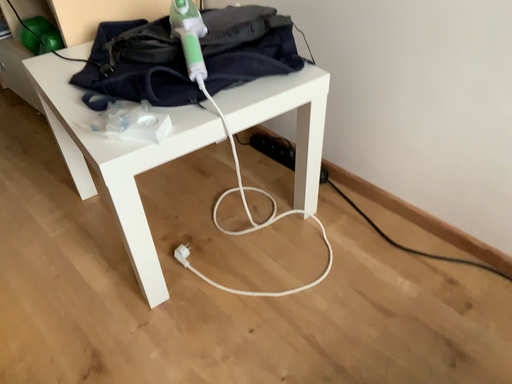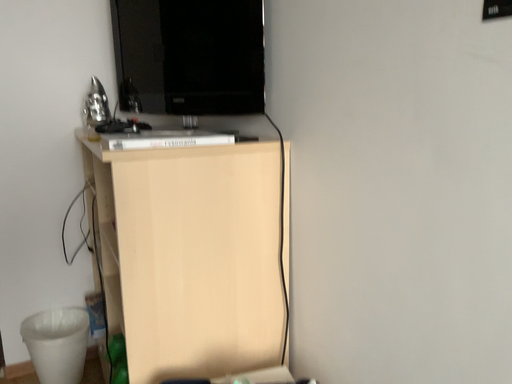
Question: How did the camera likely rotate when shooting the video?

Choices:
 (A) rotated left
 (B) rotated right

Answer: (A)